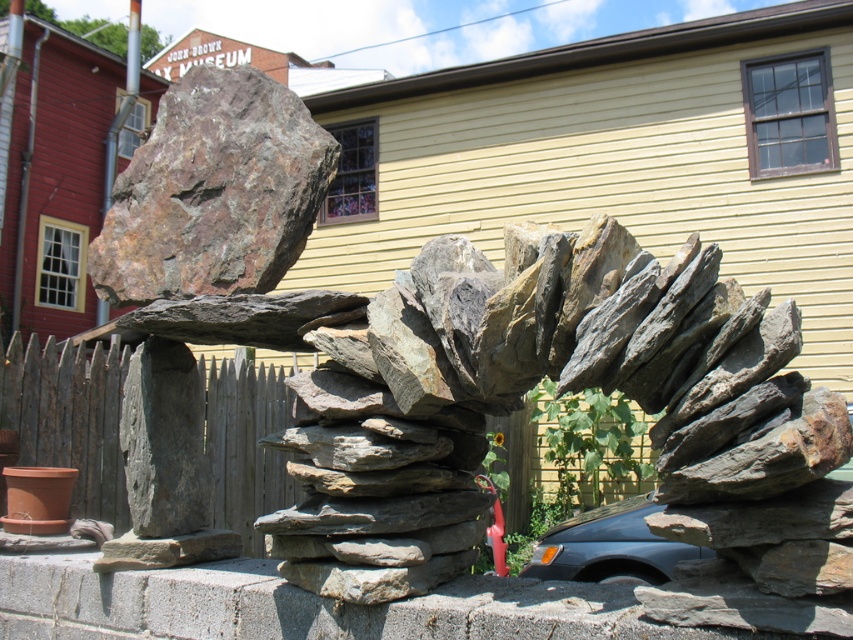
Question: Does rusty metallic boulder at upper left appear under wooden picket fence at left?

Choices:
 (A) no
 (B) yes

Answer: (A)

Question: Among these objects, which one is nearest to the camera?

Choices:
 (A) rusty metallic boulder at upper left
 (B) wooden picket fence at left

Answer: (A)

Question: Does rusty metallic boulder at upper left have a larger size compared to wooden picket fence at left?

Choices:
 (A) no
 (B) yes

Answer: (A)

Question: Does rusty metallic boulder at upper left appear over wooden picket fence at left?

Choices:
 (A) no
 (B) yes

Answer: (B)